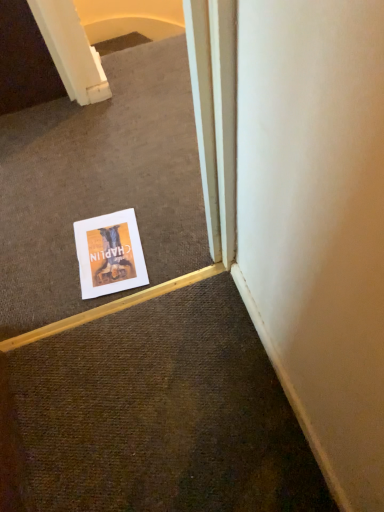
Find the location of a particular element. This screenshot has height=512, width=384. unoccupied space behind white paper poster at center is located at coordinates (103, 194).